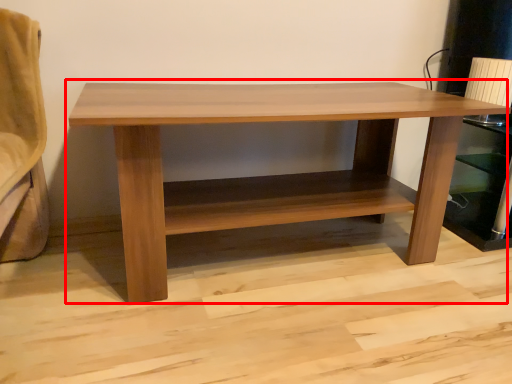
Question: From the image, what is the correct spatial relationship of table (annotated by the red box) in relation to shelf?

Choices:
 (A) right
 (B) left

Answer: (B)